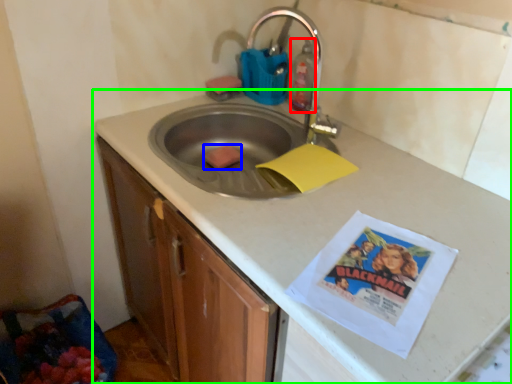
Question: Estimate the real-world distances between objects in this image. Which object is closer to cleaning product (highlighted by a red box), food (highlighted by a blue box) or countertop (highlighted by a green box)?

Choices:
 (A) food
 (B) countertop

Answer: (A)